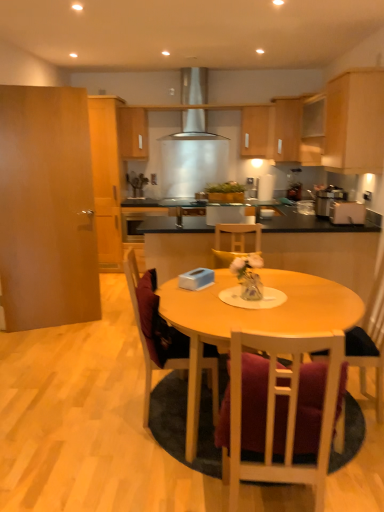
This screenshot has width=384, height=512. Identify the location of free spot in front of brown wood door at left, placed as the 8th cabinetry when sorted from right to left. (49, 343).